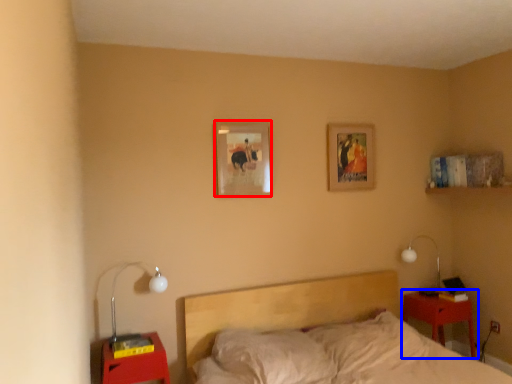
Question: Which point is further to the camera, picture frame (highlighted by a red box) or nightstand (highlighted by a blue box)?

Choices:
 (A) picture frame
 (B) nightstand

Answer: (B)